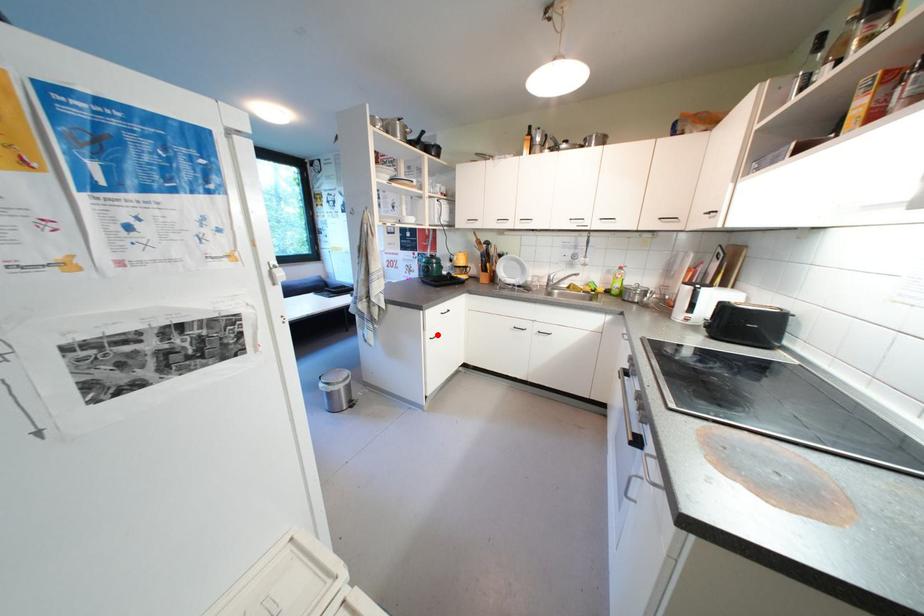
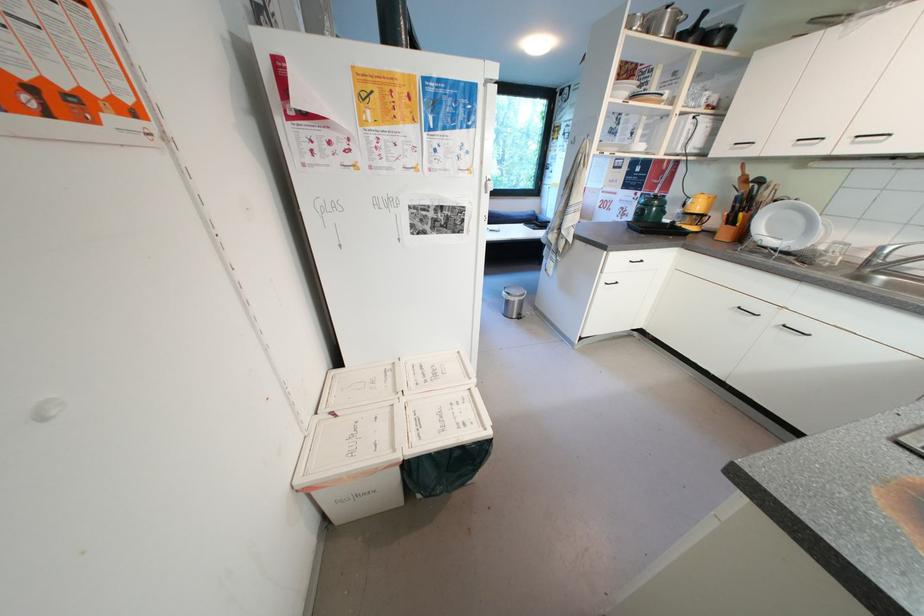
Locate, in the second image, the point that corresponds to the highlighted location in the first image.

(614, 280)